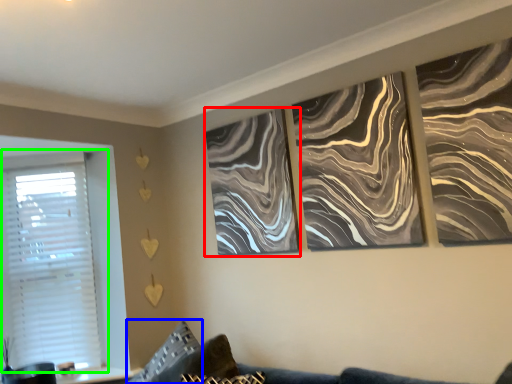
Question: Estimate the real-world distances between objects in this image. Which object is closer to canvas (highlighted by a red box), pillow (highlighted by a blue box) or window (highlighted by a green box)?

Choices:
 (A) pillow
 (B) window

Answer: (A)